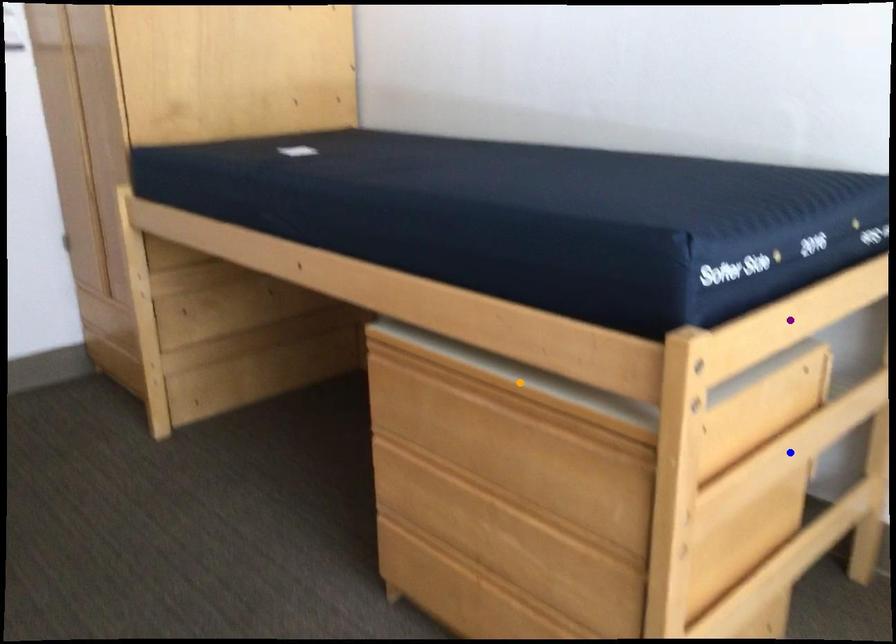
Order these from farthest to nearest:
- purple point
- blue point
- orange point

blue point < orange point < purple point